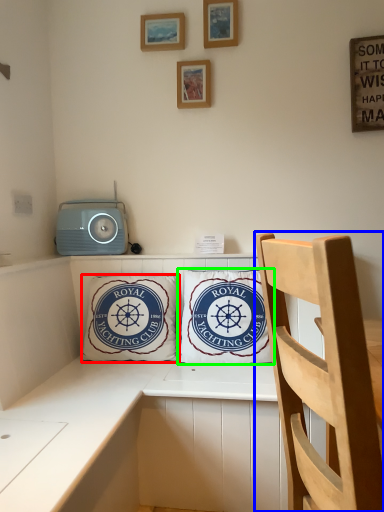
Question: Based on their relative distances, which object is nearer to pillow (highlighted by a red box)? Choose from chair (highlighted by a blue box) and pillow (highlighted by a green box).

Choices:
 (A) chair
 (B) pillow

Answer: (B)